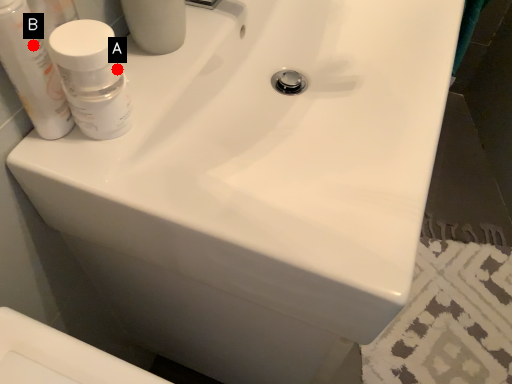
Question: Two points are circled on the image, labeled by A and B beside each circle. Which of the following is the closest to the observer?

Choices:
 (A) A is closer
 (B) B is closer

Answer: (B)